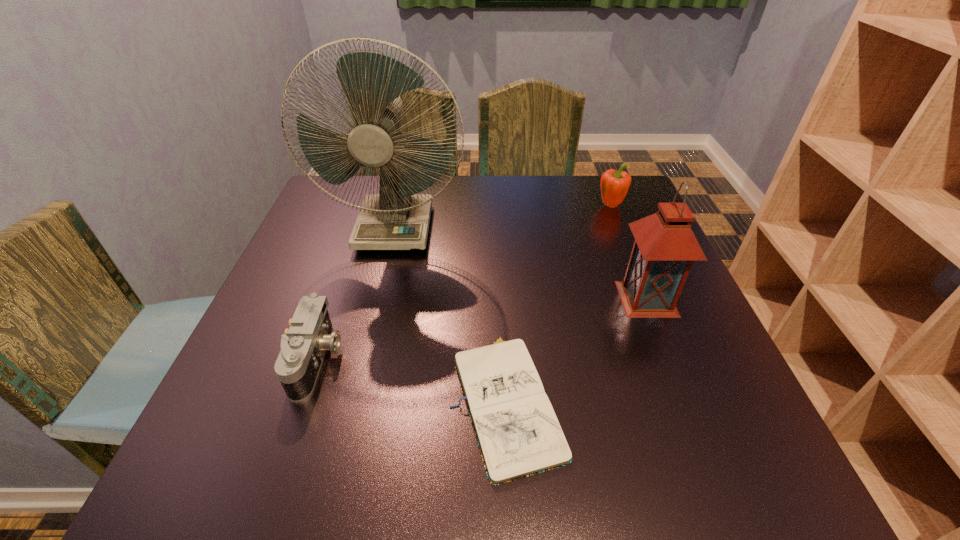
Where is `vacant space that satisfies the following two spatial constraints: 1. on the lens of the camera; 2. on the back side of the shortest object`? This screenshot has width=960, height=540. vacant space that satisfies the following two spatial constraints: 1. on the lens of the camera; 2. on the back side of the shortest object is located at coordinates (303, 399).

Where is `vacant space that satisfies the following two spatial constraints: 1. on the front-facing side of the fan; 2. on the lens of the second shortest object`? This screenshot has width=960, height=540. vacant space that satisfies the following two spatial constraints: 1. on the front-facing side of the fan; 2. on the lens of the second shortest object is located at coordinates (364, 359).

You are a GUI agent. You are given a task and a screenshot of the screen. Output one action in this format:
    pyautogui.click(x=<x>, y=<y>)
    Task: Click on the free location that satisfies the following two spatial constraints: 1. on the front-facing side of the fan; 2. on the left side of the notebook
    This screenshot has width=960, height=540.
    Given the screenshot: What is the action you would take?
    pyautogui.click(x=353, y=399)